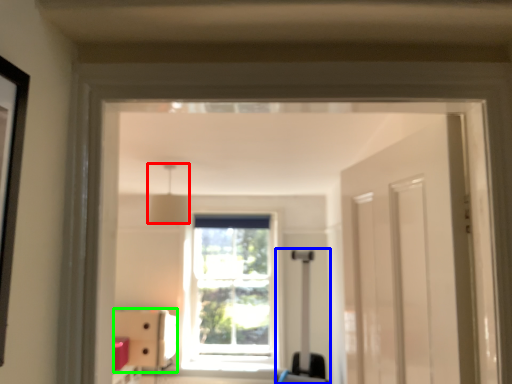
Question: Which object is positioned closest to light fixture (highlighted by a red box)? Select from luggage (highlighted by a blue box) and furniture (highlighted by a green box).

Choices:
 (A) luggage
 (B) furniture

Answer: (A)